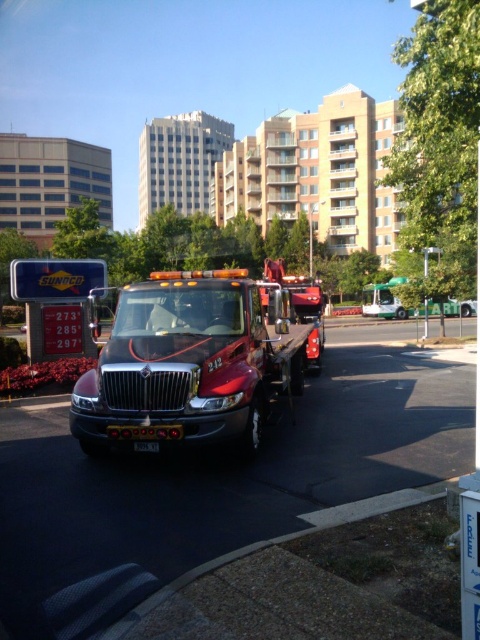
Question: Which object is closer to the camera taking this photo?

Choices:
 (A) black plastic license plate at center
 (B) shiny red tow truck at center

Answer: (B)

Question: Which of the following is the farthest from the observer?

Choices:
 (A) shiny red tow truck at center
 (B) black plastic license plate at center

Answer: (B)

Question: Does shiny red tow truck at center appear on the right side of black plastic license plate at center?

Choices:
 (A) yes
 (B) no

Answer: (B)

Question: Can you confirm if shiny red tow truck at center is positioned above black plastic license plate at center?

Choices:
 (A) no
 (B) yes

Answer: (B)

Question: Is shiny red tow truck at center wider than black plastic license plate at center?

Choices:
 (A) no
 (B) yes

Answer: (B)

Question: Which point is closer to the camera?

Choices:
 (A) (139, 444)
 (B) (136, 353)

Answer: (A)